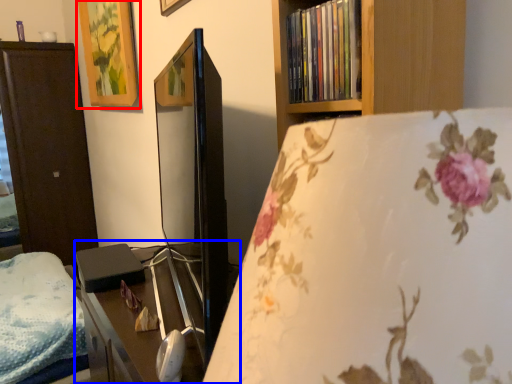
Question: Which of the following is the farthest to the observer, picture frame (highlighted by a red box) or table (highlighted by a blue box)?

Choices:
 (A) picture frame
 (B) table

Answer: (A)